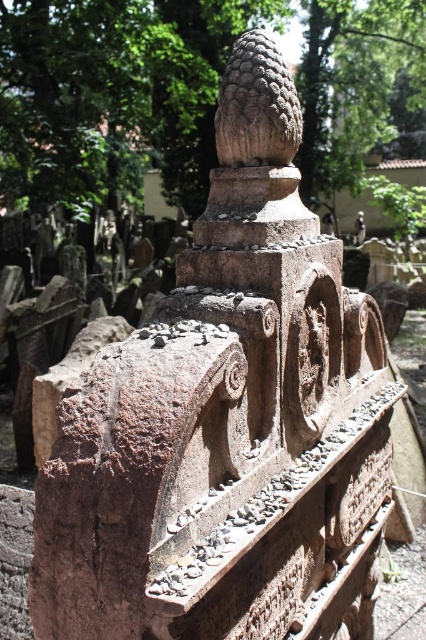
Can you confirm if brown stone cone at center is taller than rough stone cone at upper center?

Yes.

Does brown stone cone at center come behind rough stone cone at upper center?

Yes, it is.

Is point (60, 189) positioned after point (267, 115)?

That is True.

Locate an element on the screen. The width and height of the screenshot is (426, 640). brown stone cone at center is located at coordinates (115, 92).